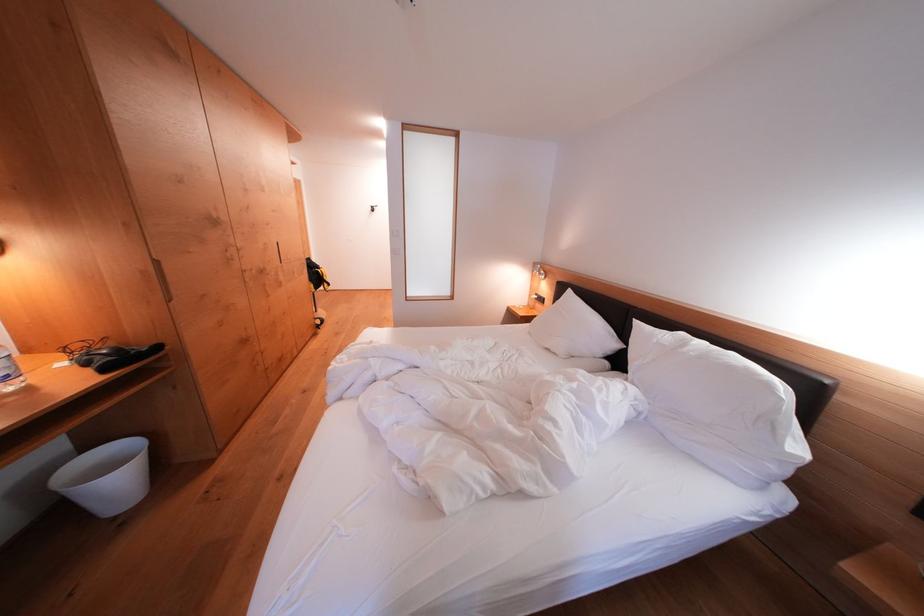
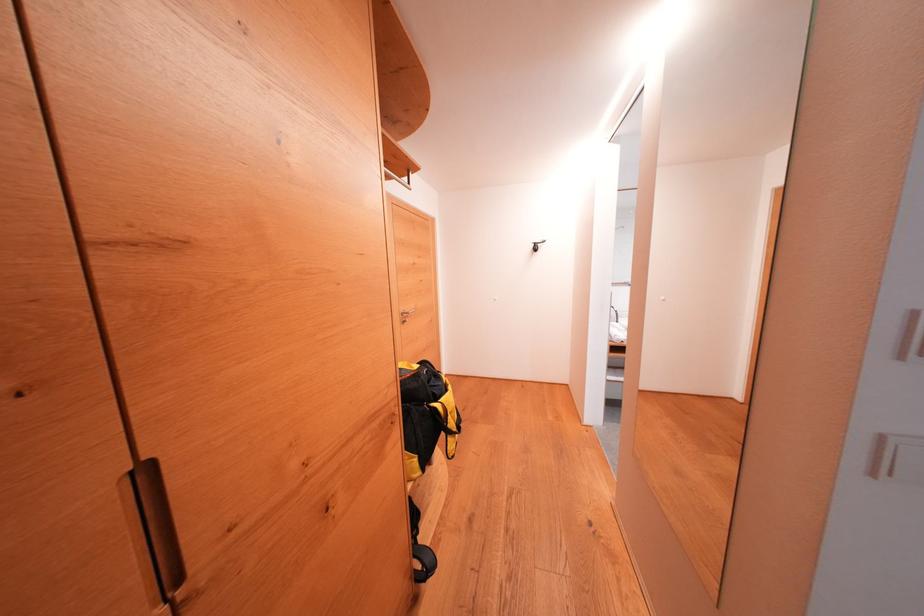
Which direction would the cameraman need to move to produce the second image?

The cameraman moved toward left, forward.